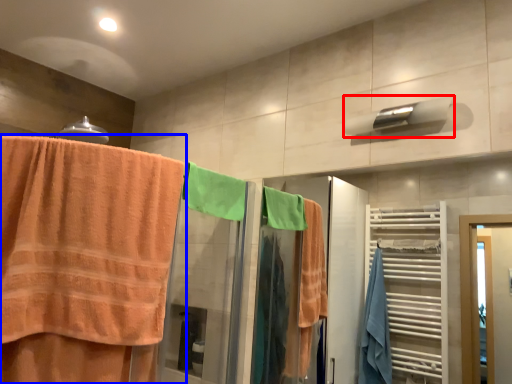
Question: Which object appears farthest to the camera in this image, towel bar (highlighted by a red box) or towel (highlighted by a blue box)?

Choices:
 (A) towel bar
 (B) towel

Answer: (A)